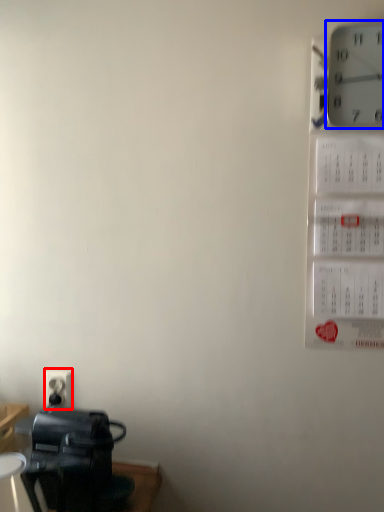
Question: Which of the following is the closest to the observer, electric outlet (highlighted by a red box) or wall clock (highlighted by a blue box)?

Choices:
 (A) electric outlet
 (B) wall clock

Answer: (B)